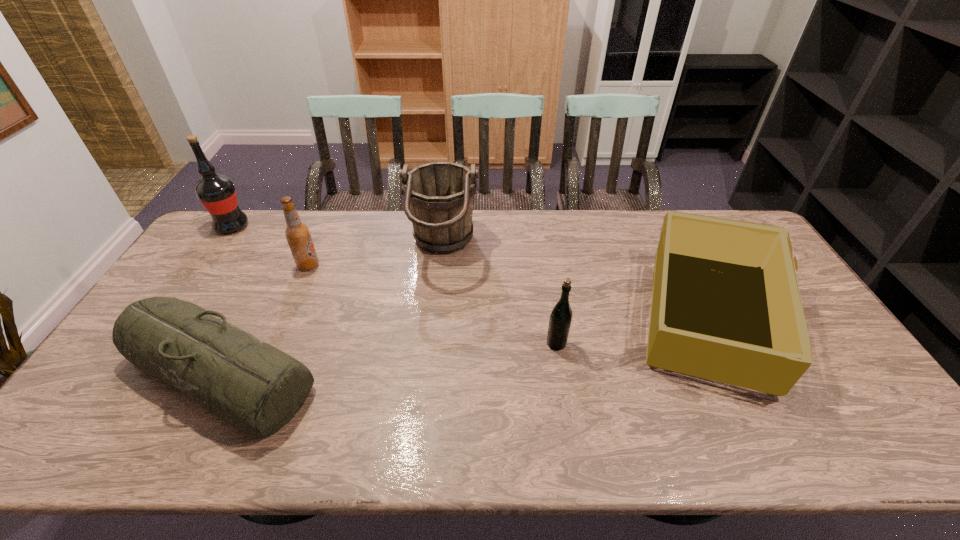
The image size is (960, 540). Find the location of `wine bottle`. wine bottle is located at coordinates (217, 193).

Find the location of a particular element. Image resolution: width=960 pixels, height=540 pixels. bucket is located at coordinates (439, 196).

At what (x,y) coordinates should I click in order to perform the action: click on the left beer bottle. Please return your answer as a coordinate pair (x, y). This screenshot has width=960, height=540. Looking at the image, I should click on point(297,234).

Locate an element on the screen. The height and width of the screenshot is (540, 960). the right beer bottle is located at coordinates (561, 316).

You are a GUI agent. You are given a task and a screenshot of the screen. Output one action in this format:
    pyautogui.click(x=<x>, y=<y>)
    Task: Click on the nearer beer bottle
    The width and height of the screenshot is (960, 540).
    Given the screenshot: What is the action you would take?
    pyautogui.click(x=561, y=316)

The width and height of the screenshot is (960, 540). Find the location of `the fifth tallest object`. the fifth tallest object is located at coordinates (726, 306).

Find the location of a particular element. The width and height of the screenshot is (960, 540). the rightmost object is located at coordinates (726, 306).

Find the location of `duffel bag`. duffel bag is located at coordinates (256, 388).

Locate an element on the screen. vacant region located on the front of the wine bottle is located at coordinates (204, 267).

What are the coordinates of `vacant space located 0.080m on the handle side of the bucket` in the screenshot? It's located at (502, 248).